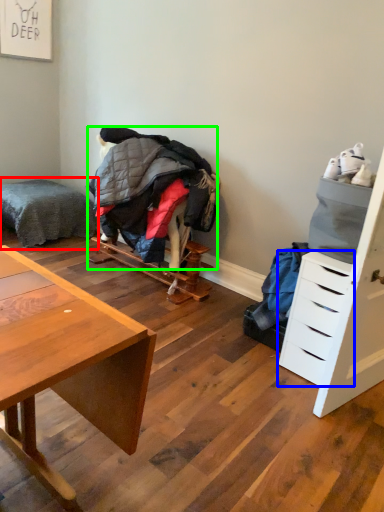
Question: Which object is the farthest from bed (highlighted by a red box)? Choose among these: drawer (highlighted by a blue box) or clothing (highlighted by a green box).

Choices:
 (A) drawer
 (B) clothing

Answer: (A)